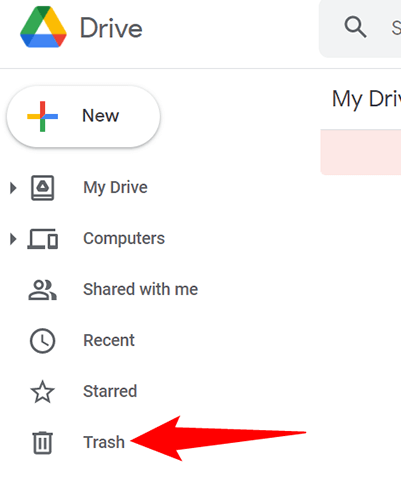
At what (x,y) coordinates should I click in order to perform the action: click on clock hand. Please return your answer as a coordinate pair (x, y). Looking at the image, I should click on (43, 338), (47, 343).